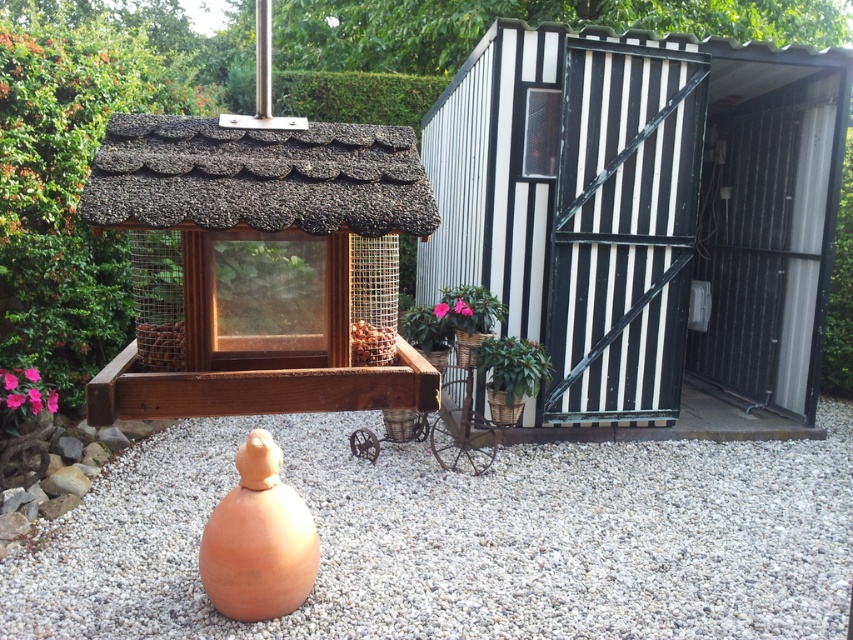
Question: Which point is farther to the camera?

Choices:
 (A) pink glossy flower pot at center
 (B) black corrugated metal shed at center

Answer: (B)

Question: Does black corrugated metal shed at center have a greater width compared to pink glossy flower pot at center?

Choices:
 (A) yes
 (B) no

Answer: (A)

Question: Which of these objects is positioned farthest from the white gravel at center?

Choices:
 (A) black corrugated metal shed at center
 (B) green leafy plant at right

Answer: (B)

Question: Which point is closer to the camera taking this photo?

Choices:
 (A) (85, 612)
 (B) (519, 340)
 (C) (437, 308)

Answer: (A)

Question: Is green leafy plant at right further to the viewer compared to green matte plant at center?

Choices:
 (A) no
 (B) yes

Answer: (B)

Question: Can you confirm if white gravel at center is positioned below green matte plant at lower center?

Choices:
 (A) no
 (B) yes

Answer: (B)